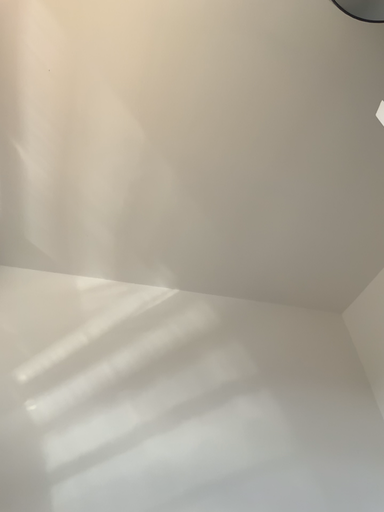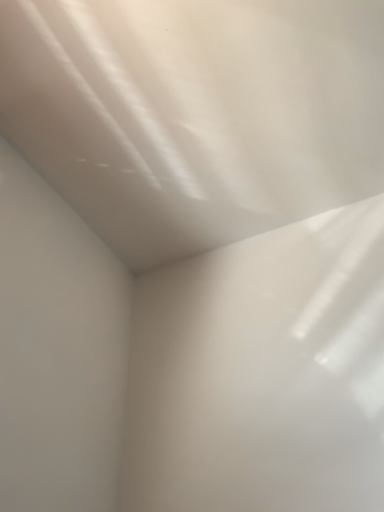
Question: Which way did the camera rotate in the video?

Choices:
 (A) rotated left
 (B) rotated right

Answer: (A)